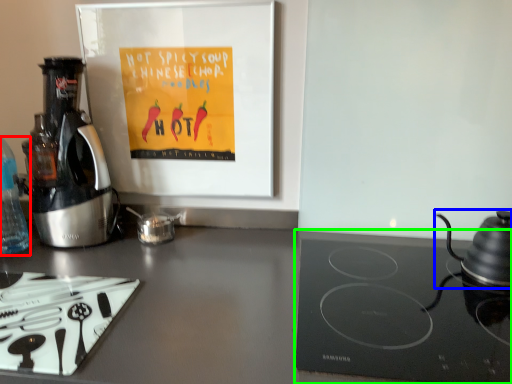
Question: Which object is positioned closest to bottle (highlighted by a red box)? Select from kitchen appliance (highlighted by a blue box) and gas stove (highlighted by a green box).

Choices:
 (A) kitchen appliance
 (B) gas stove

Answer: (B)